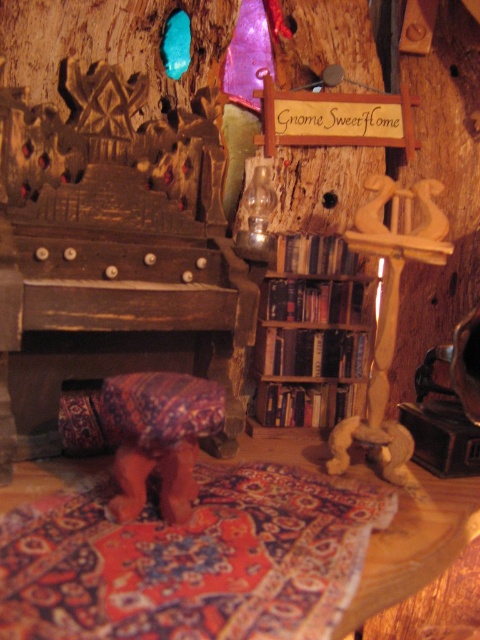
Question: Does woodenmaterial/texturebookshelf at center appear under wooden candlestick at right?

Choices:
 (A) yes
 (B) no

Answer: (A)

Question: Among these objects, which one is farthest from the camera?

Choices:
 (A) woodenmaterial/texturebookshelf at center
 (B) patterned fabric stool at center
 (C) wooden candlestick at right

Answer: (A)

Question: Considering the relative positions of patterned fabric stool at center and wooden candlestick at right in the image provided, where is patterned fabric stool at center located with respect to wooden candlestick at right?

Choices:
 (A) below
 (B) above

Answer: (A)

Question: Considering the real-world distances, which object is closest to the wooden candlestick at right?

Choices:
 (A) woodenmaterial/texturebookshelf at center
 (B) patterned fabric stool at center

Answer: (A)

Question: Does woodenmaterial/texturebookshelf at center have a greater width compared to wooden candlestick at right?

Choices:
 (A) no
 (B) yes

Answer: (B)

Question: Which of the following is the closest to the observer?

Choices:
 (A) (394, 433)
 (B) (295, 282)
 (C) (143, 484)

Answer: (C)